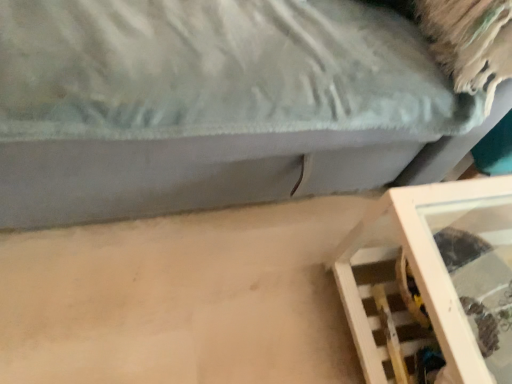
What do you see at coordinates (223, 114) in the screenshot? The width and height of the screenshot is (512, 384). I see `wooden frame at lower right, which appears as the 1th furniture when viewed from the top` at bounding box center [223, 114].

Locate an element on the screen. Image resolution: width=512 pixels, height=384 pixels. wooden frame at lower right, the second furniture in the bottom-to-top sequence is located at coordinates (223, 114).

What are the coordinates of `wooden shelf at lower right, the 2th furniture from the top` in the screenshot? It's located at (421, 264).

What do you see at coordinates (421, 264) in the screenshot? I see `wooden shelf at lower right, the 2th furniture from the top` at bounding box center [421, 264].

Locate an element on the screen. Image resolution: width=512 pixels, height=384 pixels. wooden frame at lower right, which appears as the 1th furniture when viewed from the top is located at coordinates (223, 114).

Is wooden frame at lower right, which appears as the 1th furniture when viewed from the top, to the right of wooden shelf at lower right, which is the first furniture from bottom to top, from the viewer's perspective?

No, wooden frame at lower right, which appears as the 1th furniture when viewed from the top, is not to the right of wooden shelf at lower right, which is the first furniture from bottom to top.

Based on the photo, who is more distant, wooden frame at lower right, which appears as the 1th furniture when viewed from the top, or wooden shelf at lower right, the 2th furniture from the top?

wooden shelf at lower right, the 2th furniture from the top, is further from the camera.

Which is behind, point (404, 152) or point (452, 361)?

Positioned behind is point (404, 152).

Based on the photo, from the image's perspective, which object appears higher, wooden frame at lower right, which appears as the 1th furniture when viewed from the top, or wooden shelf at lower right, the 2th furniture from the top?

wooden frame at lower right, which appears as the 1th furniture when viewed from the top.

From a real-world perspective, is wooden frame at lower right, the second furniture in the bottom-to-top sequence, under wooden shelf at lower right, the 2th furniture from the top?

Actually, wooden frame at lower right, the second furniture in the bottom-to-top sequence, is physically above wooden shelf at lower right, the 2th furniture from the top, in the real world.

Considering the sizes of objects wooden frame at lower right, the second furniture in the bottom-to-top sequence, and wooden shelf at lower right, which is the first furniture from bottom to top, in the image provided, who is wider, wooden frame at lower right, the second furniture in the bottom-to-top sequence, or wooden shelf at lower right, which is the first furniture from bottom to top,?

wooden frame at lower right, the second furniture in the bottom-to-top sequence, is wider.

Considering the sizes of objects wooden frame at lower right, which appears as the 1th furniture when viewed from the top, and wooden shelf at lower right, the 2th furniture from the top, in the image provided, who is shorter, wooden frame at lower right, which appears as the 1th furniture when viewed from the top, or wooden shelf at lower right, the 2th furniture from the top,?

wooden shelf at lower right, the 2th furniture from the top, is shorter.

Is wooden frame at lower right, the second furniture in the bottom-to-top sequence, smaller than wooden shelf at lower right, which is the first furniture from bottom to top?

Incorrect, wooden frame at lower right, the second furniture in the bottom-to-top sequence, is not smaller in size than wooden shelf at lower right, which is the first furniture from bottom to top.

Can wooden shelf at lower right, the 2th furniture from the top, be found inside wooden frame at lower right, which appears as the 1th furniture when viewed from the top?

No, wooden shelf at lower right, the 2th furniture from the top, is not inside wooden frame at lower right, which appears as the 1th furniture when viewed from the top.

Is wooden frame at lower right, the second furniture in the bottom-to-top sequence, touching wooden shelf at lower right, the 2th furniture from the top?

There is a gap between wooden frame at lower right, the second furniture in the bottom-to-top sequence, and wooden shelf at lower right, the 2th furniture from the top.

Could you tell me if wooden frame at lower right, the second furniture in the bottom-to-top sequence, is turned towards wooden shelf at lower right, the 2th furniture from the top?

Yes, wooden frame at lower right, the second furniture in the bottom-to-top sequence, is oriented towards wooden shelf at lower right, the 2th furniture from the top.

Image resolution: width=512 pixels, height=384 pixels. I want to click on furniture above the wooden shelf at lower right, which is the first furniture from bottom to top (from the image's perspective), so click(x=223, y=114).

Is wooden shelf at lower right, the 2th furniture from the top, at the left side of wooden frame at lower right, the second furniture in the bottom-to-top sequence?

No, wooden shelf at lower right, the 2th furniture from the top, is not to the left of wooden frame at lower right, the second furniture in the bottom-to-top sequence.

Which object is further away from the camera, wooden shelf at lower right, the 2th furniture from the top, or wooden frame at lower right, which appears as the 1th furniture when viewed from the top?

wooden shelf at lower right, the 2th furniture from the top, is further away from the camera.

Is point (475, 349) behind point (231, 124)?

No, (475, 349) is in front of (231, 124).

From the image's perspective, is wooden shelf at lower right, the 2th furniture from the top, under wooden frame at lower right, the second furniture in the bottom-to-top sequence?

Indeed, from the image's perspective, wooden shelf at lower right, the 2th furniture from the top, is shown beneath wooden frame at lower right, the second furniture in the bottom-to-top sequence.

From a real-world perspective, between wooden shelf at lower right, the 2th furniture from the top, and wooden frame at lower right, which appears as the 1th furniture when viewed from the top, who is vertically higher?

wooden frame at lower right, which appears as the 1th furniture when viewed from the top, from a real-world perspective.

Consider the image. In terms of width, does wooden shelf at lower right, the 2th furniture from the top, look wider or thinner when compared to wooden frame at lower right, the second furniture in the bottom-to-top sequence?

Clearly, wooden shelf at lower right, the 2th furniture from the top, has less width compared to wooden frame at lower right, the second furniture in the bottom-to-top sequence.

From their relative heights in the image, would you say wooden shelf at lower right, which is the first furniture from bottom to top, is taller or shorter than wooden frame at lower right, which appears as the 1th furniture when viewed from the top?

Clearly, wooden shelf at lower right, which is the first furniture from bottom to top, is shorter compared to wooden frame at lower right, which appears as the 1th furniture when viewed from the top.

Which of these two, wooden shelf at lower right, the 2th furniture from the top, or wooden frame at lower right, which appears as the 1th furniture when viewed from the top, is bigger?

wooden frame at lower right, which appears as the 1th furniture when viewed from the top, is bigger.

Is wooden shelf at lower right, which is the first furniture from bottom to top, situated inside wooden frame at lower right, the second furniture in the bottom-to-top sequence, or outside?

wooden shelf at lower right, which is the first furniture from bottom to top, is outside wooden frame at lower right, the second furniture in the bottom-to-top sequence.

Is the surface of wooden shelf at lower right, the 2th furniture from the top, in direct contact with wooden frame at lower right, the second furniture in the bottom-to-top sequence?

No, wooden shelf at lower right, the 2th furniture from the top, is not with wooden frame at lower right, the second furniture in the bottom-to-top sequence.

Is wooden shelf at lower right, the 2th furniture from the top, oriented towards wooden frame at lower right, which appears as the 1th furniture when viewed from the top?

No, wooden shelf at lower right, the 2th furniture from the top, is not aimed at wooden frame at lower right, which appears as the 1th furniture when viewed from the top.

You are a GUI agent. You are given a task and a screenshot of the screen. Output one action in this format:
    pyautogui.click(x=<x>, y=<y>)
    Task: Click on the furniture located behind the wooden frame at lower right, which appears as the 1th furniture when viewed from the top
    
    Given the screenshot: What is the action you would take?
    pyautogui.click(x=421, y=264)

I want to click on furniture lying on the left of wooden shelf at lower right, the 2th furniture from the top, so click(223, 114).

Find the location of `furniture positioned vertically above the wooden shelf at lower right, which is the first furniture from bottom to top (from a real-world perspective)`. furniture positioned vertically above the wooden shelf at lower right, which is the first furniture from bottom to top (from a real-world perspective) is located at coordinates (223, 114).